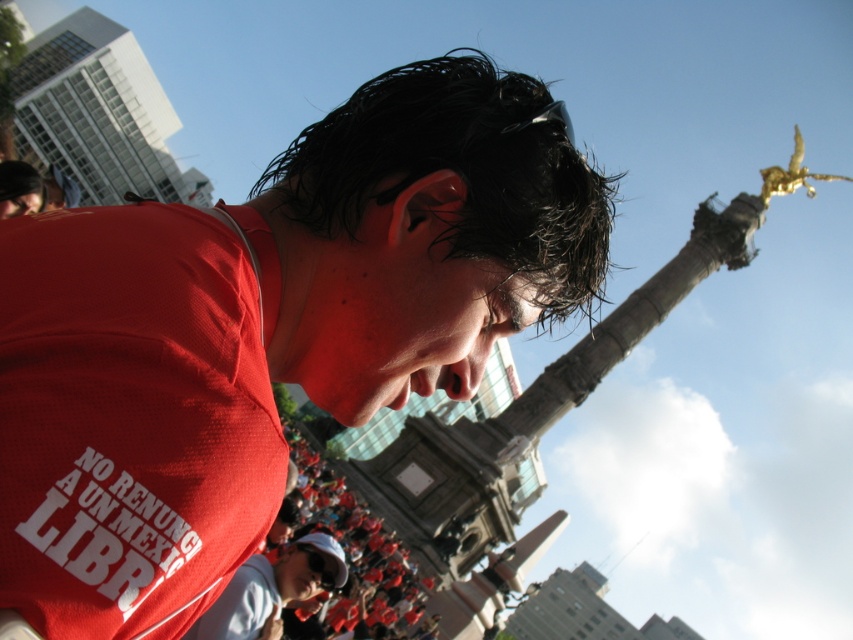
Question: Which point is farther from the camera taking this photo?

Choices:
 (A) (283, 241)
 (B) (251, 573)

Answer: (B)

Question: Does matte red jersey at center appear over matte white cap at lower center?

Choices:
 (A) yes
 (B) no

Answer: (A)

Question: Where is matte red jersey at center located in relation to matte white cap at lower center in the image?

Choices:
 (A) below
 (B) above

Answer: (B)

Question: Does matte red jersey at center come in front of matte white cap at lower center?

Choices:
 (A) yes
 (B) no

Answer: (A)

Question: Which point is farther to the camera?

Choices:
 (A) (136, 252)
 (B) (303, 586)

Answer: (B)